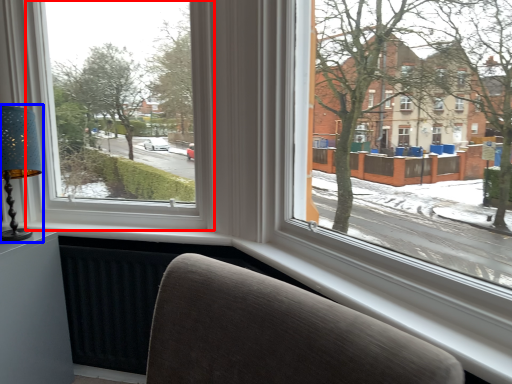
Question: Which object is closer to the camera taking this photo, window (highlighted by a red box) or table lamp (highlighted by a blue box)?

Choices:
 (A) window
 (B) table lamp

Answer: (A)